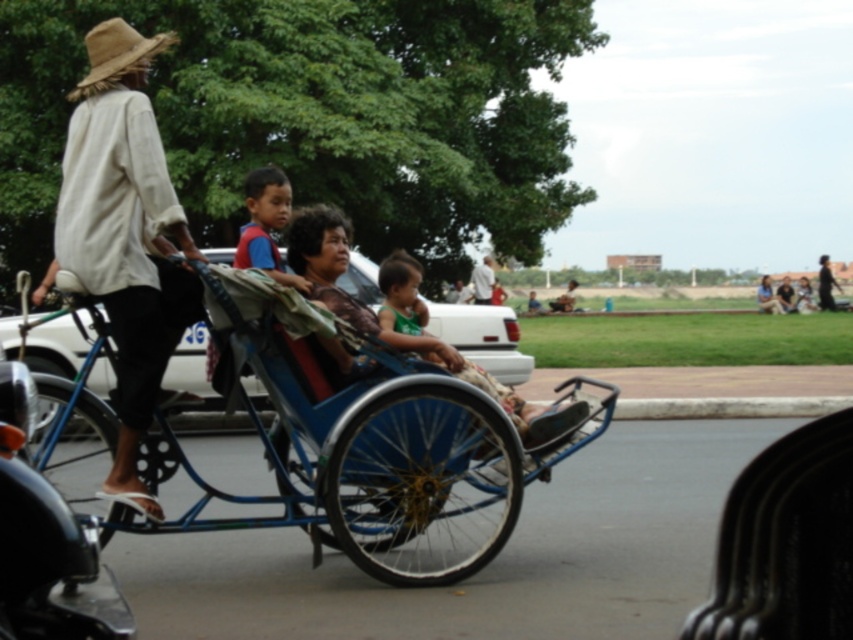
Who is higher up, light beige cotton shirt at left or white cotton shirt at upper center?

white cotton shirt at upper center is above.

Based on the photo, does light beige cotton shirt at left have a smaller size compared to white cotton shirt at upper center?

Correct, light beige cotton shirt at left occupies less space than white cotton shirt at upper center.

Based on the photo, who is more forward, [102,32] or [479,266]?

Point [102,32] is in front.

I want to click on light beige cotton shirt at left, so click(x=125, y=234).

Is natural straw hat at upper left below white cotton shirt at upper center?

No.

Image resolution: width=853 pixels, height=640 pixels. What do you see at coordinates (115, 54) in the screenshot?
I see `natural straw hat at upper left` at bounding box center [115, 54].

Is point (102, 45) positioned behind point (490, 289)?

No, it is not.

What are the coordinates of `natural straw hat at upper left` in the screenshot? It's located at (115, 54).

Does white cotton shirt at upper center appear on the right side of dark blue fabric jacket at center?

Incorrect, white cotton shirt at upper center is not on the right side of dark blue fabric jacket at center.

Is point (471, 275) more distant than point (824, 259)?

No, it is not.

Where is `white cotton shirt at upper center`? The image size is (853, 640). white cotton shirt at upper center is located at coordinates (482, 282).

This screenshot has width=853, height=640. What are the coordinates of `white cotton shirt at upper center` in the screenshot? It's located at (482, 282).